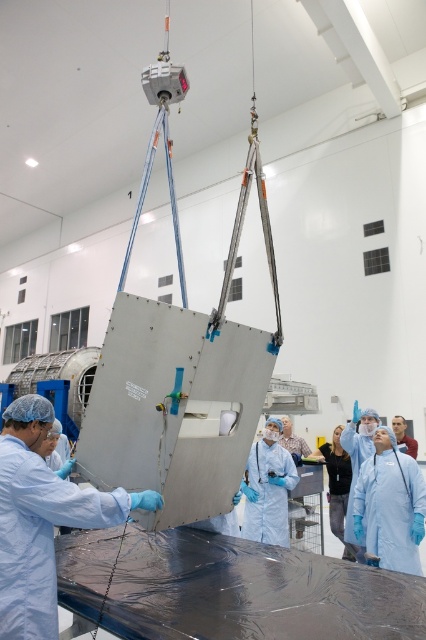
Who is lower down, gray matte panel at center or matte silver panel at center?

matte silver panel at center is below.

Who is positioned more to the left, gray matte panel at center or matte silver panel at center?

matte silver panel at center

Is point (238, 234) positioned after point (123, 502)?

Yes, point (238, 234) is behind point (123, 502).

This screenshot has width=426, height=640. What are the coordinates of `gray matte panel at center` in the screenshot? It's located at (181, 380).